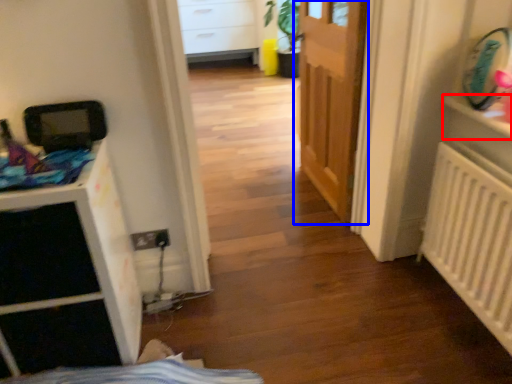
Question: Among these objects, which one is nearest to the camera, shelf (highlighted by a red box) or door (highlighted by a blue box)?

Choices:
 (A) shelf
 (B) door

Answer: (A)